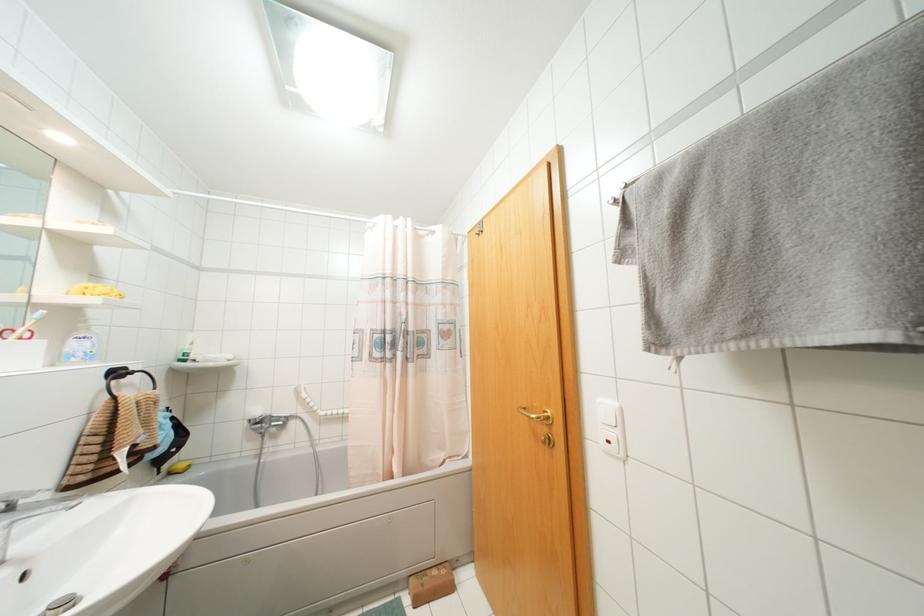
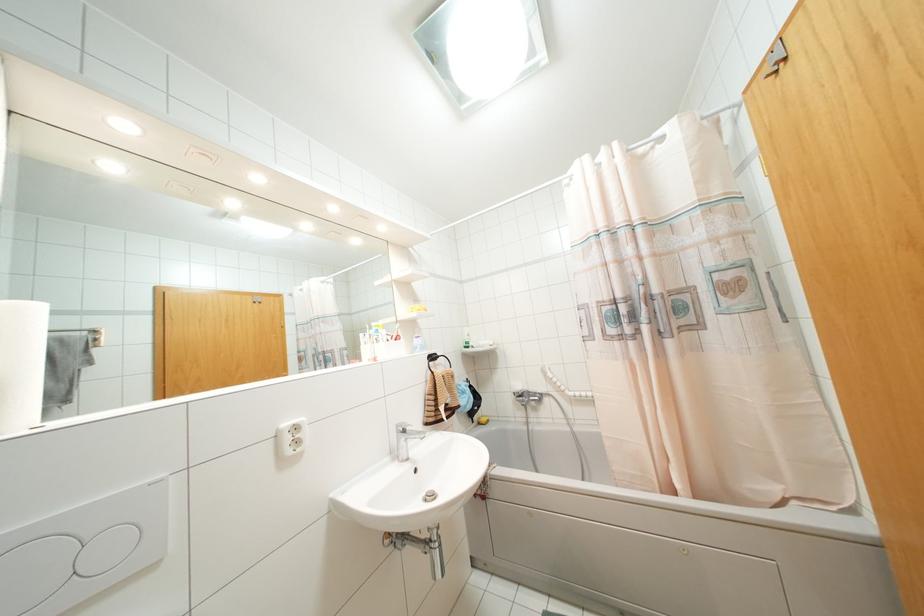
In the second image, find the point that corresponds to point (169, 472) in the first image.

(479, 423)